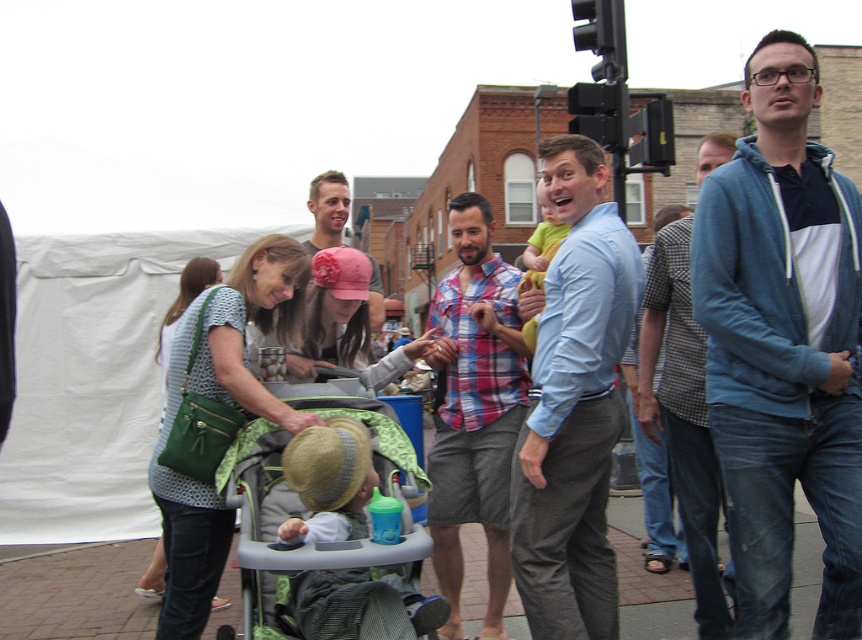
Which of these two, light blue shirt at center or blue hoodie at right, stands taller?

With more height is blue hoodie at right.

Can you confirm if light blue shirt at center is smaller than blue hoodie at right?

Indeed, light blue shirt at center has a smaller size compared to blue hoodie at right.

Locate an element on the screen. light blue shirt at center is located at coordinates (573, 404).

Looking at this image, is plaid shirt at center thinner than blue hoodie at right?

Indeed, plaid shirt at center has a lesser width compared to blue hoodie at right.

Identify the location of plaid shirt at center. (473, 408).

Which is behind, point (442, 545) or point (675, 440)?

The point (442, 545) is more distant.

What are the coordinates of `plaid shirt at center` in the screenshot? It's located at (473, 408).

Does blue fleece jacket at upper right have a smaller size compared to plaid shirt at center?

No.

Is blue fleece jacket at upper right positioned in front of plaid shirt at center?

Yes, it is in front of plaid shirt at center.

Does point (711, 406) come behind point (475, 470)?

No, it is not.

At what (x,y) coordinates should I click in order to perform the action: click on blue fleece jacket at upper right. Please return your answer as a coordinate pair (x, y). The width and height of the screenshot is (862, 640). Looking at the image, I should click on (784, 346).